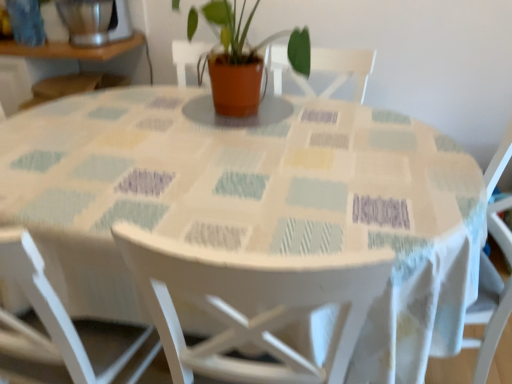
The image size is (512, 384). Identify the location of vacant area in front of matte terracotta pot at center. (228, 145).